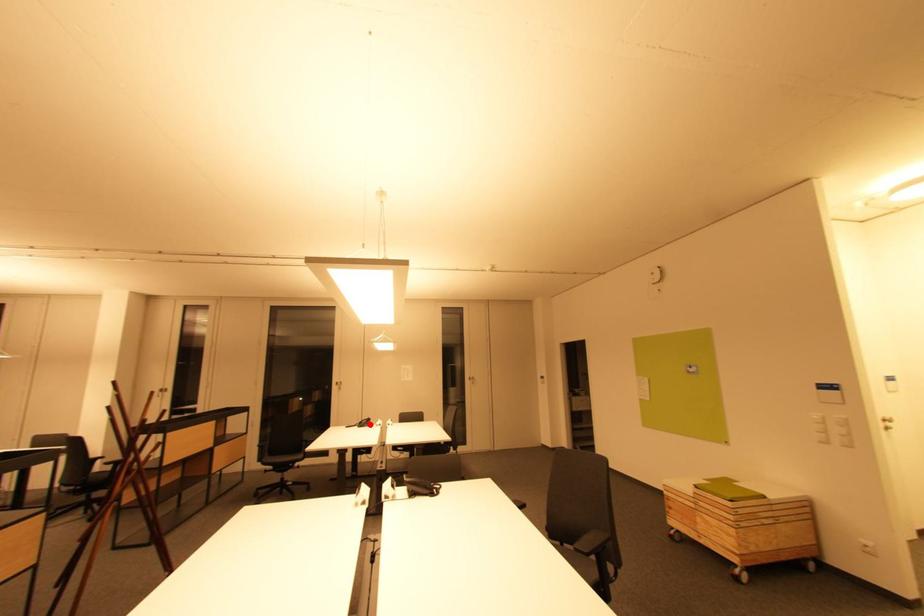
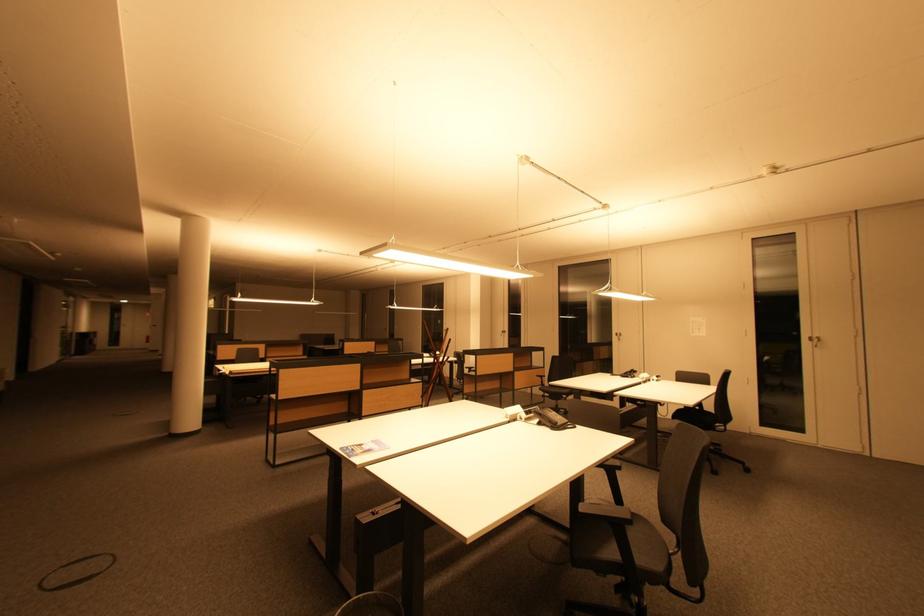
Where in the second image is the point corresponding to the highlighted location from the first image?

(635, 376)